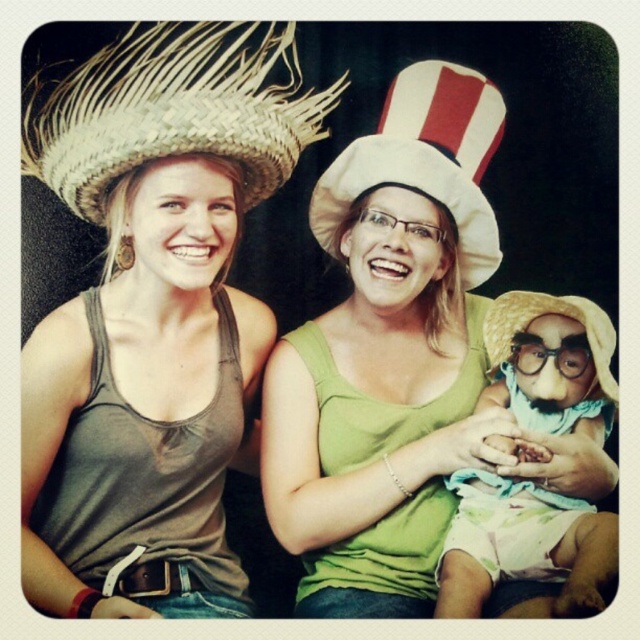
Question: Which point is closer to the camera taking this photo?

Choices:
 (A) (525, 586)
 (B) (436, 116)
 (C) (136, 278)

Answer: (A)

Question: Which point is farther to the camera?

Choices:
 (A) (460, 272)
 (B) (33, 554)
 (C) (97, 120)

Answer: (A)

Question: Can you confirm if matte straw hat at left is positioned below light yellow straw hat at lower right?

Choices:
 (A) yes
 (B) no

Answer: (B)

Question: Considering the relative positions of light yellow straw hat at lower right and strawtexturehat at lower right in the image provided, where is light yellow straw hat at lower right located with respect to strawtexturehat at lower right?

Choices:
 (A) below
 (B) above

Answer: (A)

Question: Can you confirm if green matte tank top at center is positioned to the left of white felt hat at center?

Choices:
 (A) yes
 (B) no

Answer: (B)

Question: Which point is farther to the camera?

Choices:
 (A) (x=129, y=152)
 (B) (x=536, y=296)
 (C) (x=316, y=200)
 (D) (x=259, y=56)

Answer: (C)